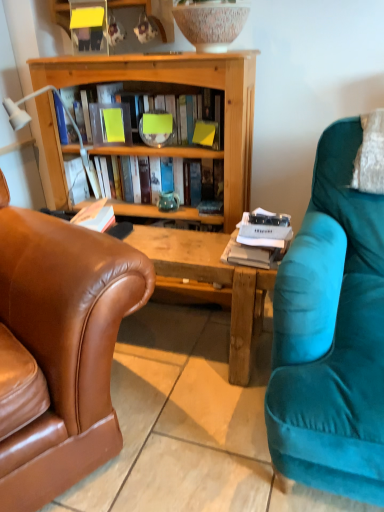
The width and height of the screenshot is (384, 512). What do you see at coordinates (64, 345) in the screenshot?
I see `brown leather chair at left` at bounding box center [64, 345].

The image size is (384, 512). In order to click on teal ceramic vase at center in this screenshot , I will do `click(168, 201)`.

Describe the element at coordinates (190, 150) in the screenshot. I see `wooden book at center, which is the 1th book from bottom to top` at that location.

What are the coordinates of `white plastic lamp at left` in the screenshot? It's located at point(69,119).

What do you see at coordinates (109, 122) in the screenshot?
I see `yellow paper at center` at bounding box center [109, 122].

The width and height of the screenshot is (384, 512). I want to click on brown leather chair at left, so click(64, 345).

Can we say white plastic lamp at left lies outside brown leather chair at left?

white plastic lamp at left lies outside brown leather chair at left's area.

From a real-world perspective, is white plastic lamp at left positioned above or below brown leather chair at left?

From a real-world perspective, white plastic lamp at left is physically above brown leather chair at left.

Is white plastic lamp at left at the left side of brown leather chair at left?

No.

Considering the relative sizes of wooden book at center, acting as the 2th book starting from the top, and teal ceramic vase at center in the image provided, is wooden book at center, acting as the 2th book starting from the top, taller than teal ceramic vase at center?

Yes.

From the image's perspective, does wooden book at center, which is the 1th book from bottom to top, appear higher than teal ceramic vase at center?

Indeed, from the image's perspective, wooden book at center, which is the 1th book from bottom to top, is shown above teal ceramic vase at center.

Is wooden book at center, which is the 1th book from bottom to top, turned away from teal ceramic vase at center?

That's right, wooden book at center, which is the 1th book from bottom to top, is facing away from teal ceramic vase at center.

Measure the distance from wooden book at center, acting as the 2th book starting from the top, to teal ceramic vase at center.

wooden book at center, acting as the 2th book starting from the top, is 6.72 inches from teal ceramic vase at center.

Is teal ceramic vase at center not close to matte yellow book at center, the first book positioned from the top?

No.

The height and width of the screenshot is (512, 384). What are the coordinates of `the 2nd book positioned above the teal ceramic vase at center (from a real-world perspective)` in the screenshot? It's located at (198, 118).

In the image, is teal ceramic vase at center on the left side or the right side of matte yellow book at center, which appears as the 2th book when ordered from the bottom?

teal ceramic vase at center is to the right of matte yellow book at center, which appears as the 2th book when ordered from the bottom.

Looking at the image, does yellow paper at center seem bigger or smaller compared to brown leather chair at left?

Considering their sizes, yellow paper at center takes up less space than brown leather chair at left.

Which object is further away from the camera, yellow paper at center or brown leather chair at left?

Positioned behind is yellow paper at center.

What's the angular difference between yellow paper at center and brown leather chair at left's facing directions?

There is a 42.4-degree angle between the facing directions of yellow paper at center and brown leather chair at left.

Considering the relative sizes of yellow paper at center and brown leather chair at left in the image provided, is yellow paper at center shorter than brown leather chair at left?

Yes.

Which of these two, yellow paper at center or matte yellow book at center, the first book positioned from the top, stands shorter?

With less height is yellow paper at center.

From the image's perspective, is yellow paper at center over matte yellow book at center, which appears as the 2th book when ordered from the bottom?

No, from the image's perspective, yellow paper at center is not on top of matte yellow book at center, which appears as the 2th book when ordered from the bottom.

Looking at this image, from a real-world perspective, which object rests below the other?

yellow paper at center is physically lower.

Considering the relative sizes of yellow paper at center and matte yellow book at center, the first book positioned from the top, in the image provided, is yellow paper at center wider than matte yellow book at center, the first book positioned from the top,?

No, yellow paper at center is not wider than matte yellow book at center, the first book positioned from the top.

You are a GUI agent. You are given a task and a screenshot of the screen. Output one action in this format:
    pyautogui.click(x=<x>, y=<y>)
    Task: Click on the book behind the matte yellow book at center, the first book positioned from the top
    
    Given the screenshot: What is the action you would take?
    pyautogui.click(x=190, y=150)

Which is nearer, (196, 113) or (100, 150)?

Point (196, 113) is closer to the camera than point (100, 150).

From a real-world perspective, which object rests below the other?

brown leather chair at left.

Is matte yellow book at center, which appears as the 2th book when ordered from the bottom, smaller than brown leather chair at left?

Correct, matte yellow book at center, which appears as the 2th book when ordered from the bottom, occupies less space than brown leather chair at left.

Considering the relative sizes of matte yellow book at center, which appears as the 2th book when ordered from the bottom, and brown leather chair at left in the image provided, is matte yellow book at center, which appears as the 2th book when ordered from the bottom, shorter than brown leather chair at left?

Correct, matte yellow book at center, which appears as the 2th book when ordered from the bottom, is not as tall as brown leather chair at left.

Are matte yellow book at center, which appears as the 2th book when ordered from the bottom, and brown leather chair at left located far from each other?

No, there isn't a large distance between matte yellow book at center, which appears as the 2th book when ordered from the bottom, and brown leather chair at left.

In order to click on lamp on the right of brown leather chair at left in this screenshot , I will do `click(69, 119)`.

Where is `book that is the 1st object located in front of the teal ceramic vase at center`? book that is the 1st object located in front of the teal ceramic vase at center is located at coordinates (190, 150).

Based on their spatial positions, is matte yellow book at center, the first book positioned from the top, or yellow paper at center further from white plastic lamp at left?

matte yellow book at center, the first book positioned from the top, is further to white plastic lamp at left.

From the image, which object appears to be farther from yellow paper at center, brown leather chair at left or white plastic lamp at left?

brown leather chair at left is further to yellow paper at center.

Estimate the real-world distances between objects in this image. Which object is closer to wooden book at center, acting as the 2th book starting from the top, white plastic lamp at left or teal ceramic vase at center?

The object closer to wooden book at center, acting as the 2th book starting from the top, is teal ceramic vase at center.

Consider the image. Estimate the real-world distances between objects in this image. Which object is further from yellow paper at center, brown leather chair at left or teal ceramic vase at center?

Based on the image, brown leather chair at left appears to be further to yellow paper at center.

Looking at the image, which one is located closer to white plastic lamp at left, brown leather chair at left or wooden book at center, acting as the 2th book starting from the top?

wooden book at center, acting as the 2th book starting from the top, is positioned closer to the anchor white plastic lamp at left.

Estimate the real-world distances between objects in this image. Which object is closer to yellow paper at center, white plastic lamp at left or matte yellow book at center, the first book positioned from the top?

Based on the image, matte yellow book at center, the first book positioned from the top, appears to be nearer to yellow paper at center.

Based on the photo, when comparing their distances from white plastic lamp at left, does brown leather chair at left or yellow paper at center seem further?

Among the two, brown leather chair at left is located further to white plastic lamp at left.

Looking at this image, based on their spatial positions, is teal ceramic vase at center or wooden book at center, which is the 1th book from bottom to top, closer to yellow paper at center?

wooden book at center, which is the 1th book from bottom to top, lies closer to yellow paper at center than the other object.

Image resolution: width=384 pixels, height=512 pixels. Find the location of `book positioned between brown leather chair at left and wooden book at center, acting as the 2th book starting from the top, from near to far`. book positioned between brown leather chair at left and wooden book at center, acting as the 2th book starting from the top, from near to far is located at coordinates (198, 118).

Identify the location of lamp between brown leather chair at left and matte yellow book at center, which appears as the 2th book when ordered from the bottom, in the front-back direction. The width and height of the screenshot is (384, 512). (69, 119).

Where is `paperback book between white plastic lamp at left and teal ceramic vase at center in the front-back direction`? Image resolution: width=384 pixels, height=512 pixels. paperback book between white plastic lamp at left and teal ceramic vase at center in the front-back direction is located at coordinates (109, 122).

Where is `book between matte yellow book at center, the first book positioned from the top, and teal ceramic vase at center vertically`? The height and width of the screenshot is (512, 384). book between matte yellow book at center, the first book positioned from the top, and teal ceramic vase at center vertically is located at coordinates (190, 150).